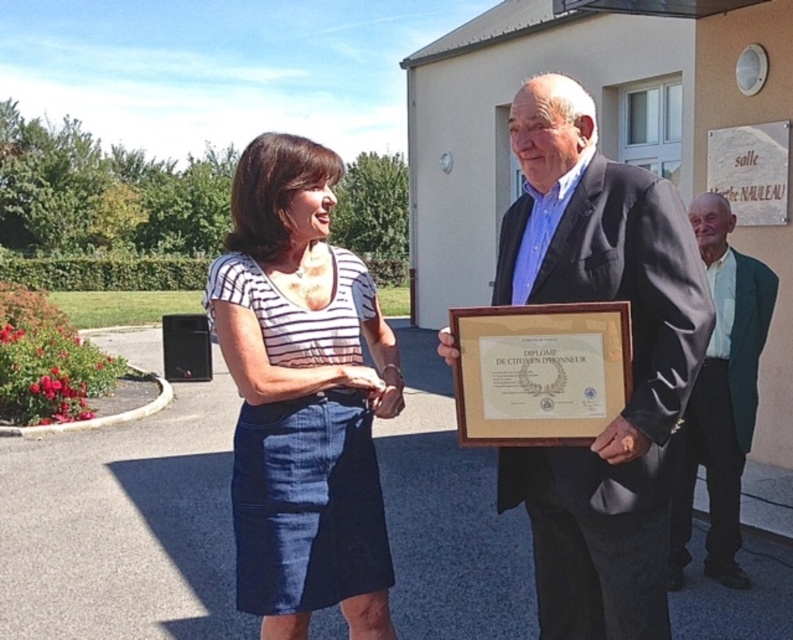
In the scene described, there is a matte black suit at center and a green textured blazer at lower right. Which of these two items is smaller in size?

The matte black suit at center is smaller in size compared to the green textured blazer at lower right.

You are organizing a clothing donation drive and need to determine which item takes up more space when folded. Based on the image, which item between the striped cotton shirt at center and the green textured blazer at lower right would require more storage space?

The green textured blazer at lower right requires more storage space when folded because it has a greater width than the striped cotton shirt at center.